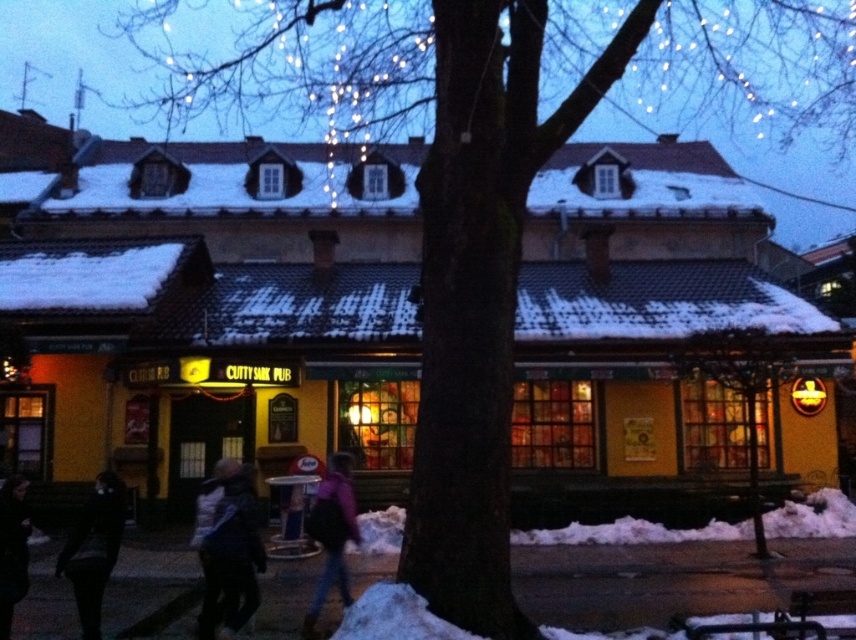
Question: Which point appears closest to the camera in this image?

Choices:
 (A) (204, 582)
 (B) (319, 604)
 (C) (9, 497)
 (D) (82, 609)

Answer: (C)

Question: Where is white fuzzy coat at lower left located in relation to purple fabric jacket at center in the image?

Choices:
 (A) above
 (B) below

Answer: (A)

Question: Is white fuzzy coat at lower left positioned at the back of dark gray jacket at lower left?

Choices:
 (A) no
 (B) yes

Answer: (B)

Question: Is dark gray jacket at lower left to the right of black leather jacket at lower left from the viewer's perspective?

Choices:
 (A) yes
 (B) no

Answer: (A)

Question: Among these objects, which one is farthest from the camera?

Choices:
 (A) dark gray jacket at lower left
 (B) white fuzzy coat at lower left

Answer: (B)

Question: Which of these objects is positioned closest to the purple fabric jacket at center?

Choices:
 (A) black leather jacket at lower left
 (B) dark gray jacket at lower left
 (C) white fuzzy coat at lower left

Answer: (C)